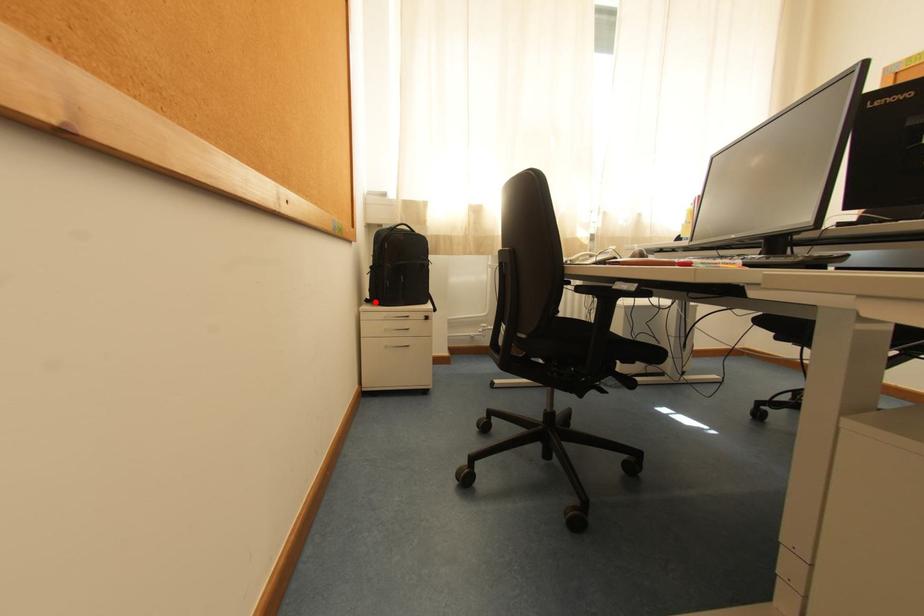
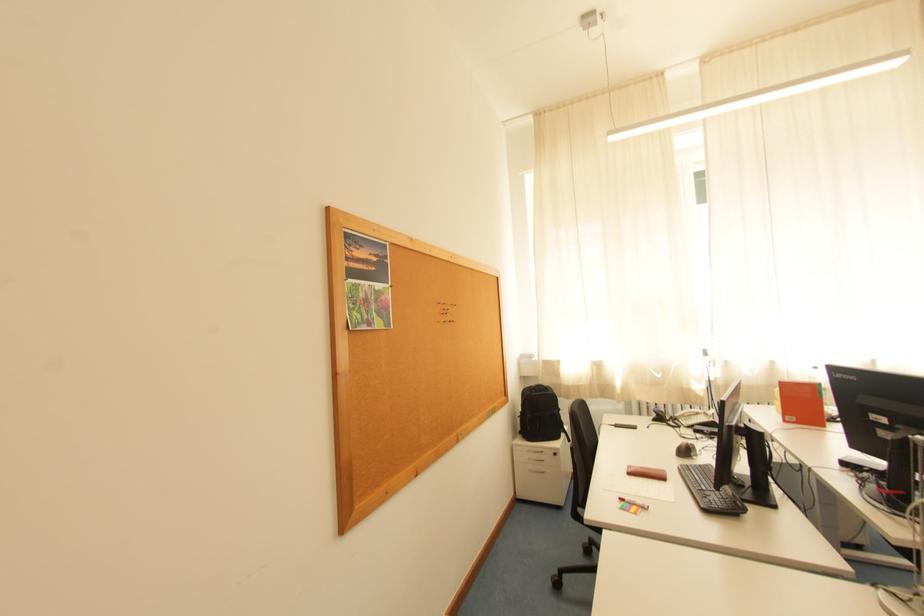
Question: I am providing you with two images of the same scene from different viewpoints. In image1, a red point is highlighted. Considering the same 3D point in image2, which of the following is correct?

Choices:
 (A) It is closer
 (B) It is farther

Answer: (B)